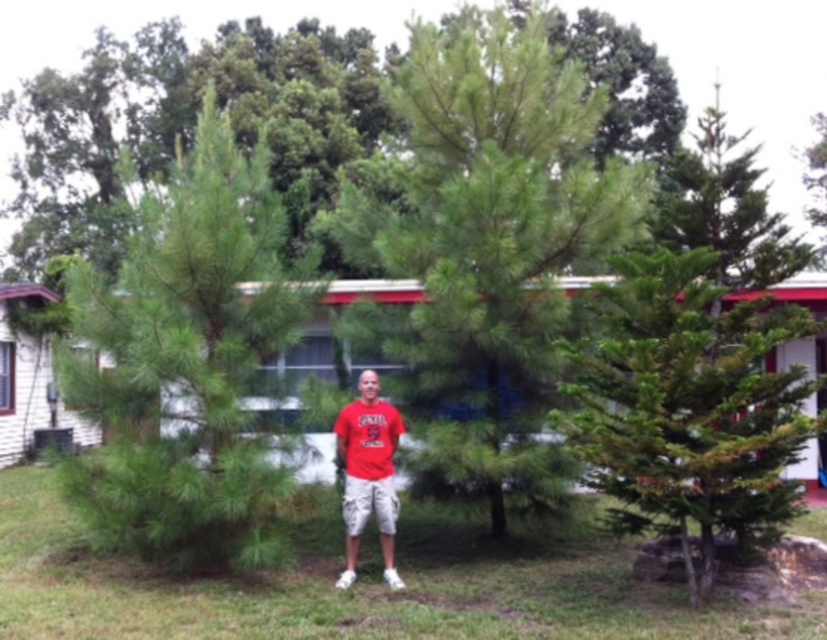
You are a photographer trying to capture the scene with the person between two pine trees. The green needle leaves at the center are at point (x=185, y=362). Where should you position the camera to ensure the person is centered between the two trees?

The green needle leaves at the center are located at point (x=185, y=362), so positioning the camera directly facing this point will ensure the person is centered between the two pine trees.